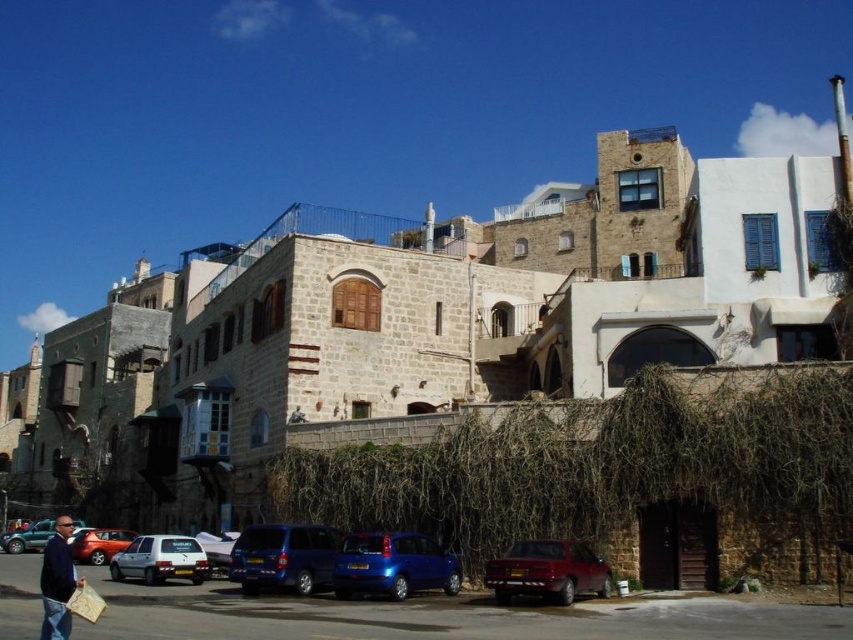
Question: Based on their relative distances, which object is farther from the brown straw at center?

Choices:
 (A) metallic blue suv at center
 (B) shiny blue car at center
 (C) matte red car at lower left
 (D) matte blue car at lower left

Answer: (D)

Question: Which object is farther from the camera taking this photo?

Choices:
 (A) metallic silver car at center
 (B) brown straw at center
 (C) blue denim jacket at lower left
 (D) matte blue car at lower left

Answer: (D)

Question: Is blue denim jacket at lower left to the right of matte blue car at lower left from the viewer's perspective?

Choices:
 (A) no
 (B) yes

Answer: (B)

Question: Can you confirm if white matte car at lower left is thinner than matte blue car at lower left?

Choices:
 (A) yes
 (B) no

Answer: (A)

Question: Based on their relative distances, which object is farther from the matte blue car at lower left?

Choices:
 (A) matte red car at lower left
 (B) metallic silver car at center

Answer: (B)

Question: Is the position of metallic blue suv at center more distant than that of matte red car at lower center?

Choices:
 (A) yes
 (B) no

Answer: (A)